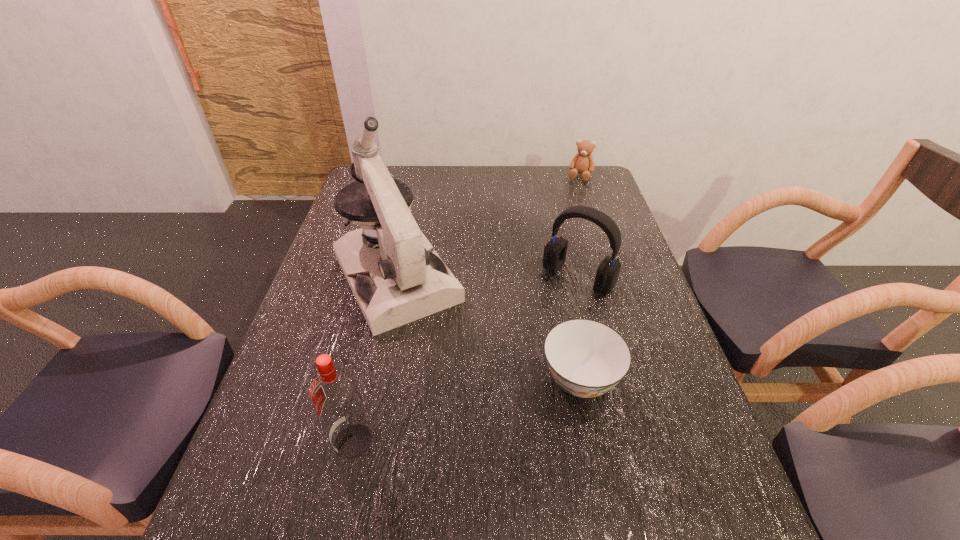
Locate an element on the screen. The image size is (960, 540). free space at the right edge of the desktop is located at coordinates (671, 409).

In the image, there is a desktop. What are the coordinates of `vacant space at the far right corner` in the screenshot? It's located at (580, 189).

Identify the location of unoccupied position between the microscope and the headset. (488, 278).

The image size is (960, 540). What are the coordinates of `free space between the tallest object and the nearest object` in the screenshot? It's located at [x=375, y=360].

Identify the location of free spot between the nearest object and the teddy bear. (467, 308).

Locate an element on the screen. This screenshot has width=960, height=540. free space between the headset and the fourth shortest object is located at coordinates [x=466, y=360].

You are a GUI agent. You are given a task and a screenshot of the screen. Output one action in this format:
    pyautogui.click(x=<x>, y=<y>)
    Task: Click on the vacant area that lies between the farthest object and the headset
    This screenshot has height=540, width=960.
    Given the screenshot: What is the action you would take?
    pyautogui.click(x=579, y=227)

This screenshot has width=960, height=540. Identify the location of free point between the shortest object and the nearest object. [467, 410].

The height and width of the screenshot is (540, 960). I want to click on free space between the tallest object and the headset, so click(x=488, y=278).

I want to click on free space between the teddy bear and the shortest object, so click(x=580, y=278).